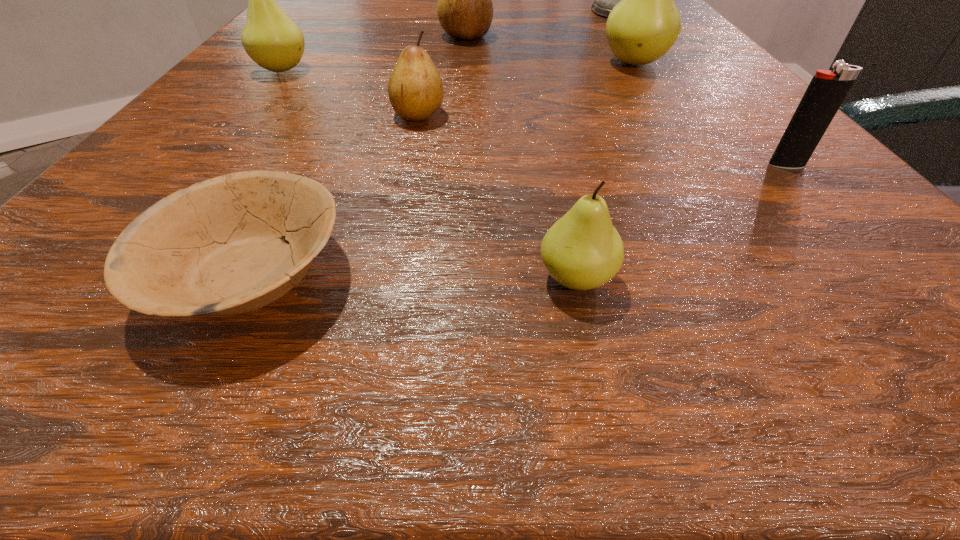
The height and width of the screenshot is (540, 960). I want to click on vacant area located on the right of the second nearest pear, so click(x=593, y=114).

Find the location of `free region located 0.220m on the right of the second green pear from left to right`. free region located 0.220m on the right of the second green pear from left to right is located at coordinates (868, 278).

You are a GUI agent. You are given a task and a screenshot of the screen. Output one action in this format:
    pyautogui.click(x=<x>, y=<y>)
    Task: Click on the free space located on the back of the bowl
    The width and height of the screenshot is (960, 540).
    Given the screenshot: What is the action you would take?
    pyautogui.click(x=303, y=169)

The height and width of the screenshot is (540, 960). I want to click on aerosol can at the far edge, so click(604, 0).

Locate an element on the screen. pear present at the far edge is located at coordinates (465, 11).

This screenshot has height=540, width=960. What are the coordinates of `pear at the near edge` in the screenshot? It's located at (582, 250).

At what (x,y) coordinates should I click in order to perform the action: click on bowl positioned at the near edge. Please return your answer as a coordinate pair (x, y). Image resolution: width=960 pixels, height=540 pixels. Looking at the image, I should click on (215, 248).

I want to click on pear situated at the left edge, so click(271, 39).

Find the location of a particular element. This screenshot has height=540, width=960. bowl positioned at the left edge is located at coordinates (215, 248).

Locate an element on the screen. aerosol can present at the right edge is located at coordinates (604, 0).